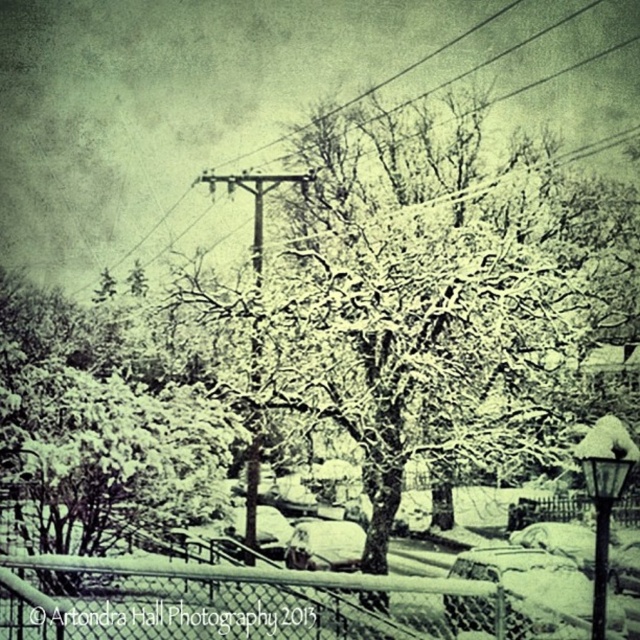
You are standing in the winter scene and want to find the point at coordinates [256,104]. According to the image description, where exactly is this point located?

The point at coordinates [256,104] is located on the snow covered wire at upper center.